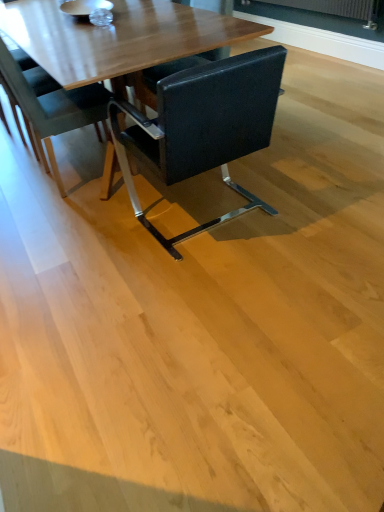
Where is `free space in front of black leather chair at center, the second chair in the left-to-right sequence`? free space in front of black leather chair at center, the second chair in the left-to-right sequence is located at coordinates (193, 288).